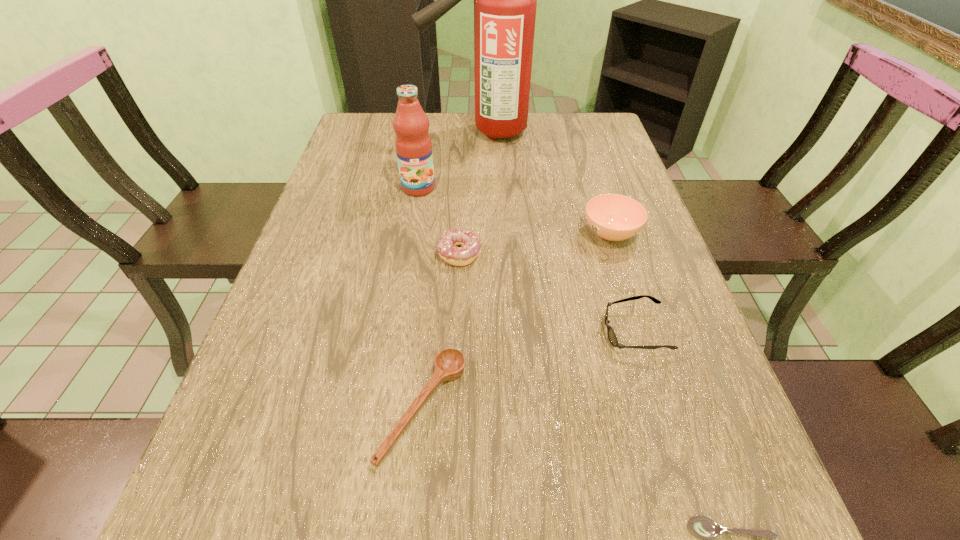
In order to click on vacant space that is in between the soup bowl and the second shortest object in this screenshot , I will do (516, 321).

You are a GUI agent. You are given a task and a screenshot of the screen. Output one action in this format:
    pyautogui.click(x=<x>, y=<y>)
    Task: Click on the vacant region between the fifth shortest object and the farthest object
    The width and height of the screenshot is (960, 540).
    Given the screenshot: What is the action you would take?
    (x=549, y=183)

Point out which object is positioned as the sixth nearest to the tallest object. Please provide its 2D coordinates. Your answer should be formatted as a tuple, i.e. [(x, y)], where the tuple contains the x and y coordinates of a point satisfying the conditions above.

[(702, 526)]

This screenshot has height=540, width=960. I want to click on the sixth closest object to the soupspoon, so click(x=505, y=0).

Locate an element on the screen. Image resolution: width=960 pixels, height=540 pixels. vacant space that satisfies the following two spatial constraints: 1. at the nozzle of the farthest object; 2. on the right side of the soup bowl is located at coordinates (490, 233).

Locate an element on the screen. vacant area that satisfies the following two spatial constraints: 1. on the back side of the third tallest object; 2. at the nozzle of the tallest object is located at coordinates (579, 132).

What are the coordinates of `free location that satisfies the following two spatial constraints: 1. at the nozzle of the farthest object; 2. on the front side of the doughnut` in the screenshot? It's located at (491, 254).